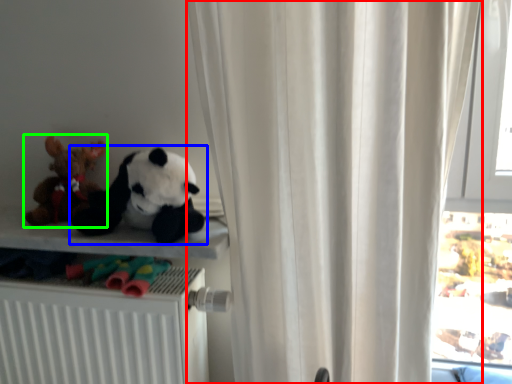
Question: Which object is positioned closest to curtain (highlighted by a red box)? Select from toy (highlighted by a blue box) and toy (highlighted by a green box).

Choices:
 (A) toy
 (B) toy

Answer: (A)